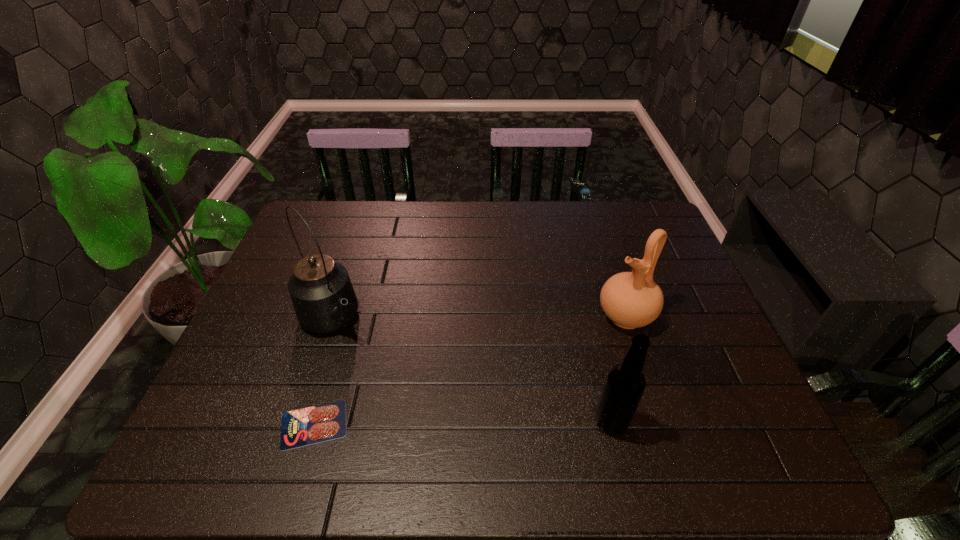
The width and height of the screenshot is (960, 540). Find the location of `salami`. salami is located at coordinates (325, 422).

Identify the location of beer bottle. This screenshot has height=540, width=960. (625, 383).

Where is `the tallest object`? This screenshot has width=960, height=540. the tallest object is located at coordinates (324, 300).

Identify the location of pottery. (630, 300).

Where is `vacant region located on the back of the shortest object`? This screenshot has height=540, width=960. vacant region located on the back of the shortest object is located at coordinates (347, 315).

Identify the location of free space located 0.190m on the left of the beer bottle. The image size is (960, 540). (506, 422).

Locate an element on the screen. This screenshot has height=540, width=960. free region located spout on the kettle is located at coordinates (396, 389).

Where is `vacant space located 0.150m spout on the kettle`? vacant space located 0.150m spout on the kettle is located at coordinates (383, 375).

Where is `vacant position located spout on the kettle`? Image resolution: width=960 pixels, height=540 pixels. vacant position located spout on the kettle is located at coordinates (373, 365).

Locate an element on the screen. free space located on the spout of the pottery is located at coordinates (545, 368).